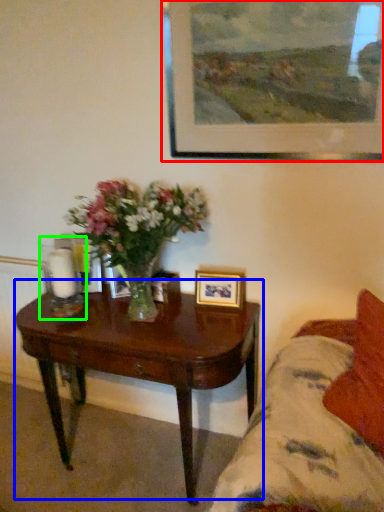
Question: Which is farther away from picture frame (highlighted by a red box)? coffee table (highlighted by a blue box) or candle holder (highlighted by a green box)?

Choices:
 (A) coffee table
 (B) candle holder

Answer: (B)